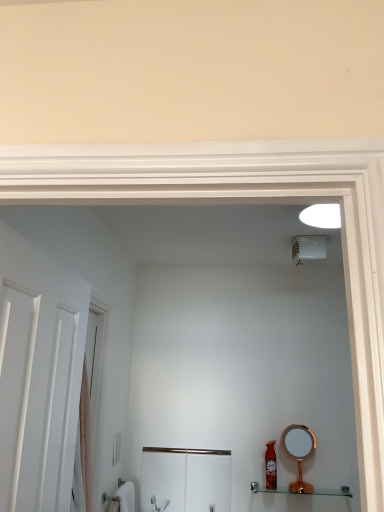
Question: Would you say pink fabric screen door at left, placed as the first screen door when sorted from front to back, is to the left or to the right of brushed metal cabinet at lower center, the 2th screen door from the left, in the picture?

Choices:
 (A) right
 (B) left

Answer: (B)

Question: Do you think pink fabric screen door at left, positioned as the second screen door in back-to-front order, is within brushed metal cabinet at lower center, acting as the first screen door starting from the right, or outside of it?

Choices:
 (A) outside
 (B) inside

Answer: (A)

Question: Which object is positioned closest to the clear glass shelf at lower right?

Choices:
 (A) copper metallic mirror at lower right
 (B) pink fabric screen door at left, positioned as the 2th screen door in bottom-to-top order
 (C) shiny red bottle at lower right
 (D) white plastic light switch at lower left
 (E) white matte door at left

Answer: (C)

Question: Estimate the real-world distances between objects in this image. Which object is closer to the pink fabric screen door at left, the 2th screen door in the right-to-left sequence?

Choices:
 (A) white plastic light switch at lower left
 (B) copper metallic mirror at lower right
 (C) brushed metal cabinet at lower center, the 2th screen door from the left
 (D) shiny red bottle at lower right
 (E) white matte door at left

Answer: (E)